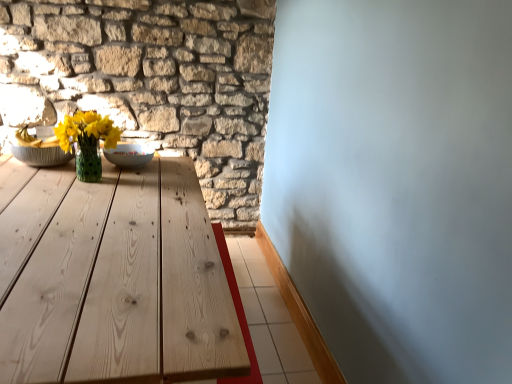
Identify the location of white glossy bowl at center. The height and width of the screenshot is (384, 512). (129, 155).

Which is less distant, (238, 7) or (142, 156)?

Point (142, 156)

From a real-world perspective, relative to white glossy bowl at center, is natural stone wall at upper left vertically above or below?

natural stone wall at upper left is situated lower than white glossy bowl at center in the real world.

Which of these two, natural stone wall at upper left or white glossy bowl at center, is wider?

Wider between the two is white glossy bowl at center.

Is natural stone wall at upper left smaller than white glossy bowl at center?

No.

From a real-world perspective, is white glossy bowl at center positioned under matte green vase at center-left based on gravity?

Correct, in the physical world, white glossy bowl at center is lower than matte green vase at center-left.

Is white glossy bowl at center beside matte green vase at center-left?

No, white glossy bowl at center is not making contact with matte green vase at center-left.

Which object is wider, white glossy bowl at center or matte green vase at center-left?

white glossy bowl at center.

From the image's perspective, is white glossy bowl at center above matte green vase at center-left?

No.

Would you say white glossy bowl at center contains natural stone wall at upper left?

That's incorrect, natural stone wall at upper left is not inside white glossy bowl at center.

How many degrees apart are the facing directions of white glossy bowl at center and natural stone wall at upper left?

The facing directions of white glossy bowl at center and natural stone wall at upper left are 2.45 degrees apart.

Which object is further away from the camera taking this photo, white glossy bowl at center or natural stone wall at upper left?

natural stone wall at upper left is further from the camera.

Considering the sizes of objects white glossy bowl at center and natural stone wall at upper left in the image provided, who is smaller, white glossy bowl at center or natural stone wall at upper left?

Smaller between the two is white glossy bowl at center.

Is matte green vase at center-left far from natural stone wall at upper left?

No, matte green vase at center-left is not far from natural stone wall at upper left.

Which is closer, (62, 133) or (246, 9)?

Positioned in front is point (62, 133).

From the image's perspective, between matte green vase at center-left and natural stone wall at upper left, which one is located above?

natural stone wall at upper left.

Between matte green vase at center-left and natural stone wall at upper left, which one appears on the right side from the viewer's perspective?

matte green vase at center-left is more to the right.

Where is `bowl directly beneath the matte green vase at center-left (from a real-world perspective)`? bowl directly beneath the matte green vase at center-left (from a real-world perspective) is located at coordinates (129, 155).

From a real-world perspective, between matte green vase at center-left and white glossy bowl at center, who is vertically higher?

From a 3D spatial view, matte green vase at center-left is above.

How different are the orientations of matte green vase at center-left and white glossy bowl at center in degrees?

0.262 degrees.

Considering the sizes of objects matte green vase at center-left and white glossy bowl at center in the image provided, who is wider, matte green vase at center-left or white glossy bowl at center?

Wider between the two is white glossy bowl at center.

Is natural stone wall at upper left wider or thinner than matte green vase at center-left?

In the image, natural stone wall at upper left appears to be more narrow than matte green vase at center-left.

Would you say matte green vase at center-left is part of natural stone wall at upper left's contents?

Definitely not — matte green vase at center-left is not inside natural stone wall at upper left.

From their relative heights in the image, would you say natural stone wall at upper left is taller or shorter than matte green vase at center-left?

Clearly, natural stone wall at upper left is taller compared to matte green vase at center-left.

Considering the sizes of objects natural stone wall at upper left and matte green vase at center-left in the image provided, who is bigger, natural stone wall at upper left or matte green vase at center-left?

natural stone wall at upper left.

Where is `bowl in front of the natural stone wall at upper left`? The height and width of the screenshot is (384, 512). bowl in front of the natural stone wall at upper left is located at coordinates (129, 155).

Locate an element on the screen. Image resolution: width=512 pixels, height=384 pixels. flower that appears above the white glossy bowl at center (from a real-world perspective) is located at coordinates (87, 130).

Estimate the real-world distances between objects in this image. Which object is closer to natural stone wall at upper left, matte green vase at center-left or white glossy bowl at center?

matte green vase at center-left is positioned closer to the anchor natural stone wall at upper left.

Consider the image. From the image, which object appears to be nearer to matte green vase at center-left, white glossy bowl at center or natural stone wall at upper left?

white glossy bowl at center is closer to matte green vase at center-left.

From the picture: Which object lies further to the anchor point natural stone wall at upper left, white glossy bowl at center or matte green vase at center-left?

white glossy bowl at center is further to natural stone wall at upper left.

Considering their positions, is natural stone wall at upper left positioned closer to matte green vase at center-left than white glossy bowl at center?

Among the two, white glossy bowl at center is located nearer to matte green vase at center-left.

Looking at the image, which one is located further to white glossy bowl at center, matte green vase at center-left or natural stone wall at upper left?

natural stone wall at upper left is positioned further to the anchor white glossy bowl at center.

Considering their positions, is natural stone wall at upper left positioned closer to white glossy bowl at center than matte green vase at center-left?

Based on the image, matte green vase at center-left appears to be nearer to white glossy bowl at center.

You are a GUI agent. You are given a task and a screenshot of the screen. Output one action in this format:
    pyautogui.click(x=<x>, y=<y>)
    Task: Click on the bowl located between matte green vase at center-left and natural stone wall at upper left in the depth direction
    The height and width of the screenshot is (384, 512).
    Given the screenshot: What is the action you would take?
    point(129,155)